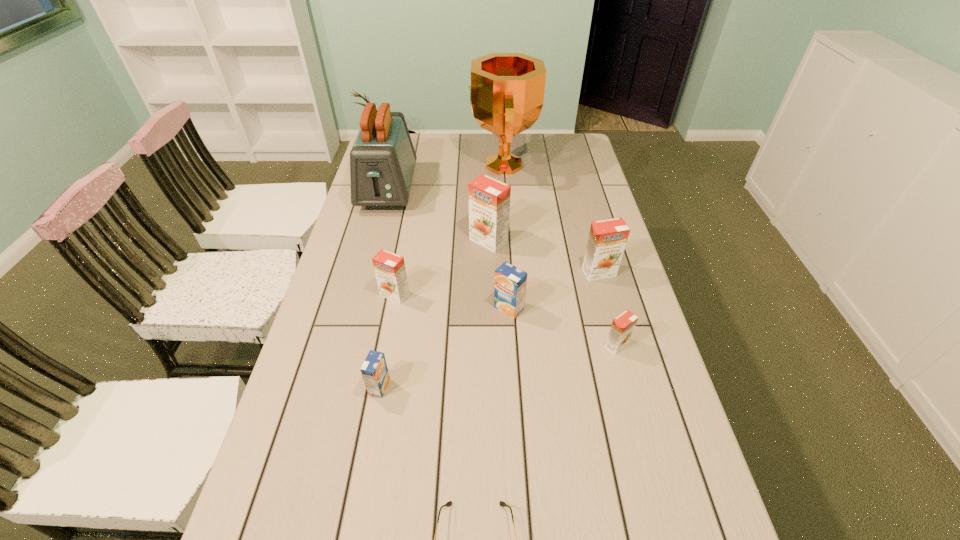
Locate an element on the screen. Image resolution: width=960 pixels, height=540 pixels. the bigger blue orange_juice is located at coordinates point(510,282).

I want to click on the second nearest object, so click(x=374, y=370).

At what (x,y) coordinates should I click in order to perform the action: click on the nearer blue orange_juice. Please return your answer as a coordinate pair (x, y). Image resolution: width=960 pixels, height=540 pixels. Looking at the image, I should click on (374, 370).

The width and height of the screenshot is (960, 540). I want to click on the third nearest object, so click(622, 327).

I want to click on the second nearest orange juice, so click(622, 327).

At what (x,y) coordinates should I click in order to perform the action: click on vacant area situated on the side of the tallest object with the star emblem. Please return your answer as a coordinate pair (x, y). This screenshot has width=960, height=540. Looking at the image, I should click on (387, 165).

Where is `vacant space situated 0.370m on the side of the tallest object with the star emblem`? This screenshot has height=540, width=960. vacant space situated 0.370m on the side of the tallest object with the star emblem is located at coordinates (377, 165).

Locate an element on the screen. vacant space located on the side of the tallest object with the star emblem is located at coordinates click(412, 165).

I want to click on vacant space located 0.260m on the front-facing side of the eighth shortest object, so click(368, 269).

This screenshot has height=540, width=960. Identify the location of vacant area situated on the back of the farthest orange juice. pyautogui.click(x=488, y=190).